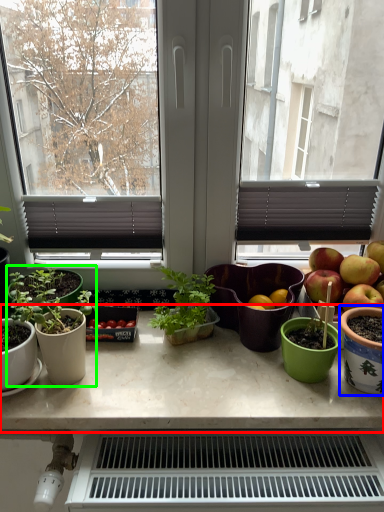
Question: Based on their relative distances, which object is farther from table (highlighted by a red box)? Choose from flowerpot (highlighted by a blue box) and houseplant (highlighted by a green box).

Choices:
 (A) flowerpot
 (B) houseplant

Answer: (A)